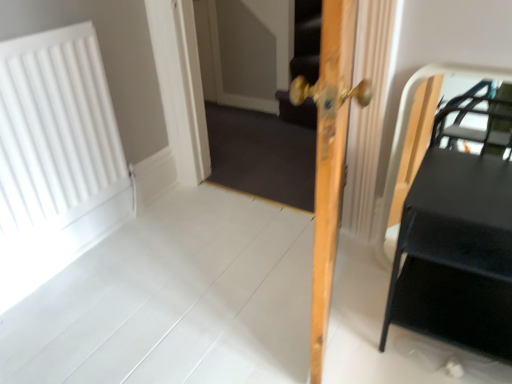
This screenshot has height=384, width=512. In order to click on free space behind light wood door at center in this screenshot , I will do `click(276, 236)`.